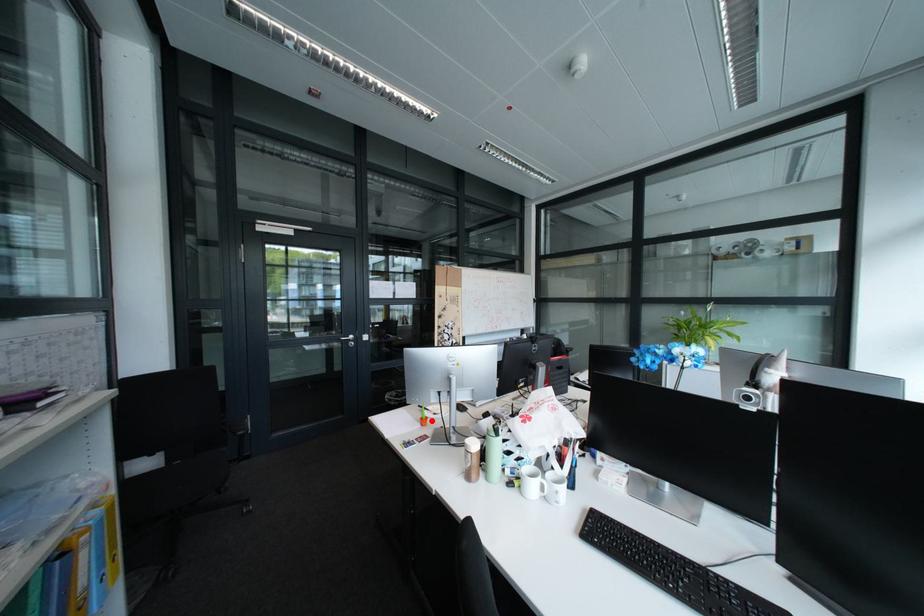
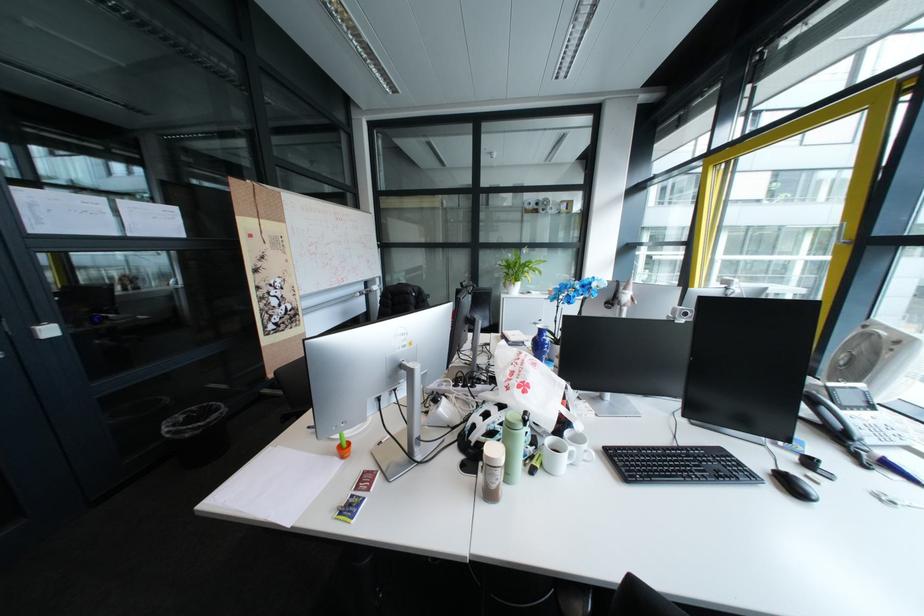
Question: I am providing you with two images of the same scene from different viewpoints. A red point is shown in image1. For the corresponding object point in image2, is it positioned nearer or farther from the camera?

Choices:
 (A) Nearer
 (B) Farther

Answer: (A)